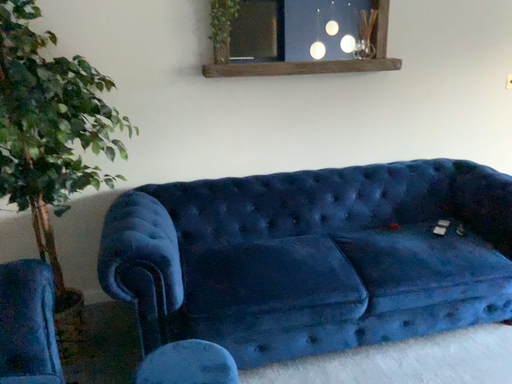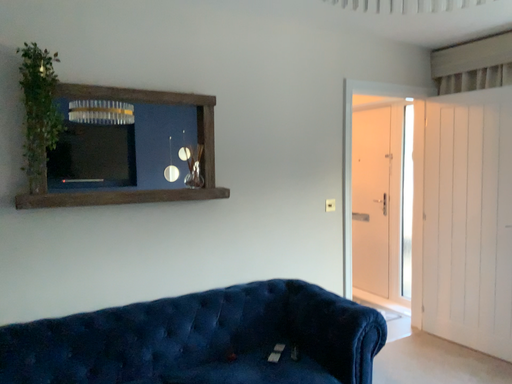
Question: Which way did the camera rotate in the video?

Choices:
 (A) rotated downward
 (B) rotated upward

Answer: (B)